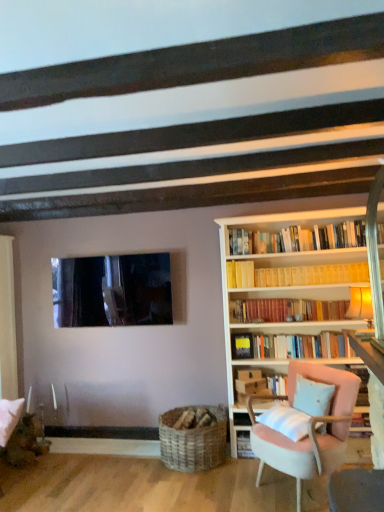
Where is `free spot to the left of woven wood basket at lower center`? The width and height of the screenshot is (384, 512). free spot to the left of woven wood basket at lower center is located at coordinates (125, 466).